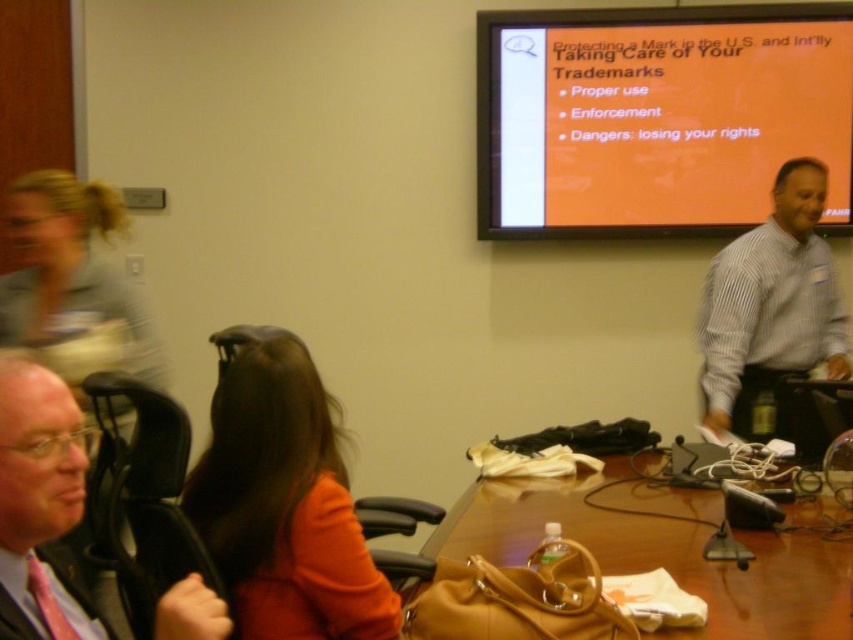
Can you confirm if orange matte projection screen at upper center is positioned below white striped shirt at upper right?

Actually, orange matte projection screen at upper center is above white striped shirt at upper right.

Is orange matte projection screen at upper center shorter than white striped shirt at upper right?

Indeed, orange matte projection screen at upper center has a lesser height compared to white striped shirt at upper right.

Does point (682, 220) come closer to viewer compared to point (791, 304)?

No, (682, 220) is behind (791, 304).

Where is `orange matte projection screen at upper center`? orange matte projection screen at upper center is located at coordinates (656, 115).

From the picture: Is brown leather table at center positioned in front of matte black chair at left?

No, it is behind matte black chair at left.

Looking at this image, is brown leather table at center shorter than matte black chair at left?

Yes, brown leather table at center is shorter than matte black chair at left.

At what (x,y) coordinates should I click in order to perform the action: click on brown leather table at center. Please return your answer as a coordinate pair (x, y). The height and width of the screenshot is (640, 853). Looking at the image, I should click on (624, 572).

Can you confirm if orange matte projection screen at upper center is shorter than matte black chair at left?

No, orange matte projection screen at upper center is not shorter than matte black chair at left.

Which is more to the right, orange matte projection screen at upper center or matte black chair at left?

From the viewer's perspective, orange matte projection screen at upper center appears more on the right side.

This screenshot has width=853, height=640. Identify the location of orange matte projection screen at upper center. (656, 115).